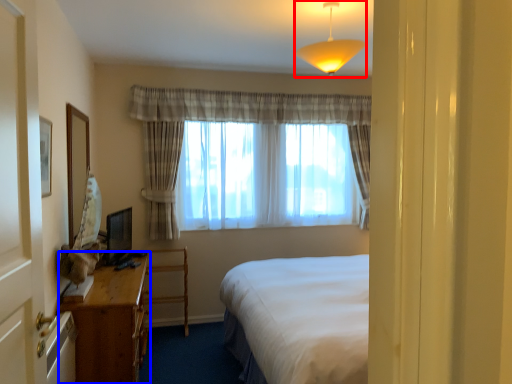
Question: Which object is further to the camera taking this photo, lamp (highlighted by a red box) or desk (highlighted by a blue box)?

Choices:
 (A) lamp
 (B) desk

Answer: (B)